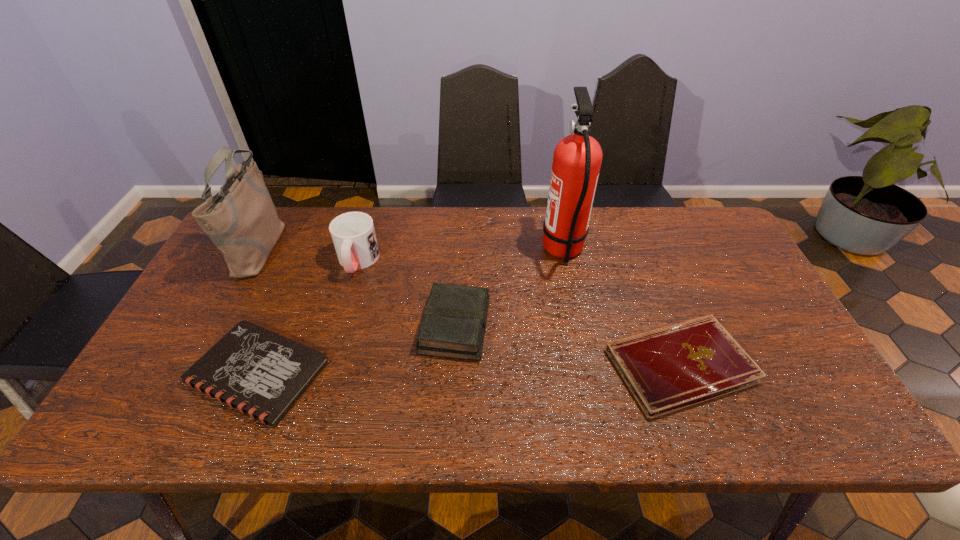
Identify the location of fire extinguisher. Image resolution: width=960 pixels, height=540 pixels. (577, 158).

Find the location of a particular element. the fifth shortest object is located at coordinates (241, 220).

The height and width of the screenshot is (540, 960). I want to click on mug, so click(x=353, y=234).

This screenshot has height=540, width=960. What are the coordinates of `book` in the screenshot? It's located at (454, 321).

Locate an element on the screen. The width and height of the screenshot is (960, 540). the third shortest object is located at coordinates (454, 321).

You are a GUI agent. You are given a task and a screenshot of the screen. Output one action in this format:
    pyautogui.click(x=<x>, y=<y>)
    Task: Click on the right notebook
    The width and height of the screenshot is (960, 540).
    Given the screenshot: What is the action you would take?
    pyautogui.click(x=667, y=369)

Locate an element on the screen. The width and height of the screenshot is (960, 540). the left notebook is located at coordinates (261, 373).

The width and height of the screenshot is (960, 540). I want to click on free location located on the handle side of the tallest object, so click(x=451, y=251).

Identify the location of free point located 0.070m on the handle side of the tallest object. (518, 251).

This screenshot has height=540, width=960. I want to click on vacant space located 0.210m on the handle side of the tallest object, so click(x=474, y=251).